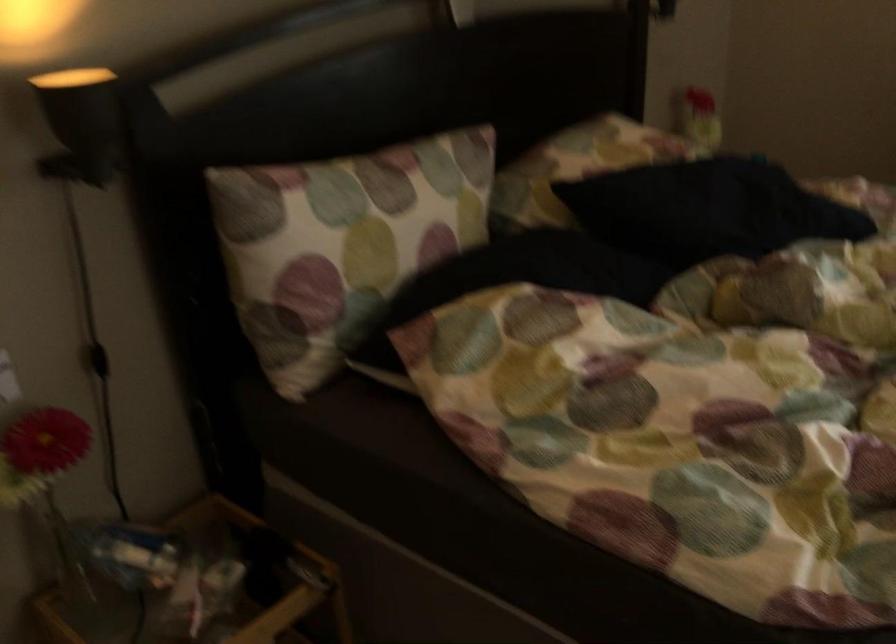
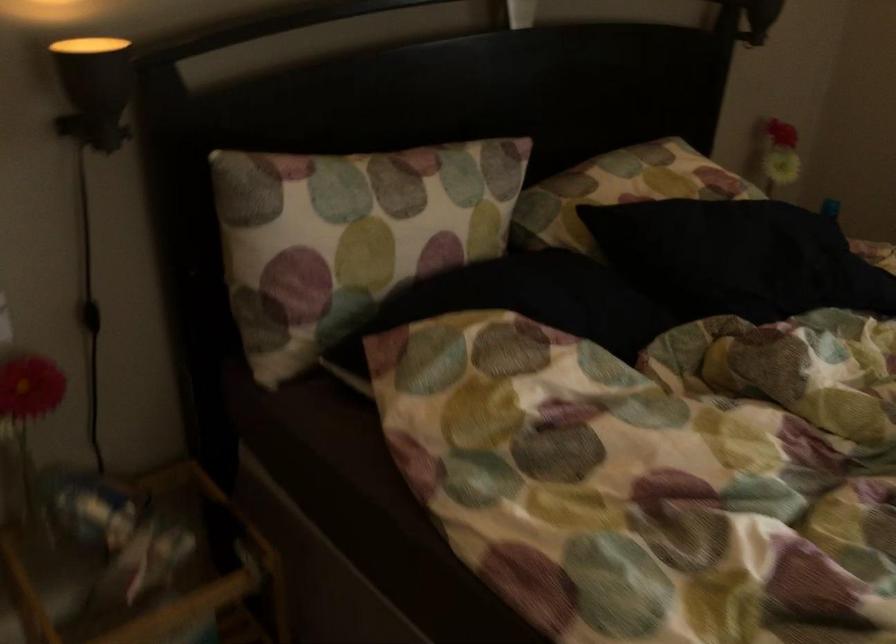
Locate, in the second image, the point that corresponds to (x=97, y=360) in the first image.

(90, 316)